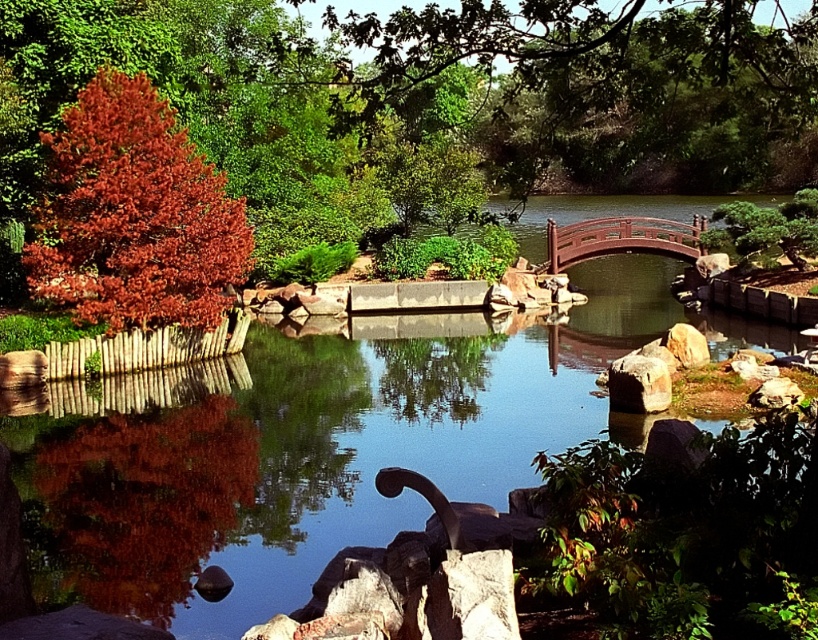
Question: Which point is closer to the camera taking this photo?

Choices:
 (A) (63, 244)
 (B) (609, 401)
 (C) (681, 225)

Answer: (B)

Question: From the image, what is the correct spatial relationship of shiny red tree at left in relation to wooden bridge at center?

Choices:
 (A) right
 (B) left

Answer: (B)

Question: Is shiny red tree at left thinner than wooden bridge at center?

Choices:
 (A) no
 (B) yes

Answer: (A)

Question: Which object is farther from the camera taking this photo?

Choices:
 (A) rusty metallic rock at lower right
 (B) shiny red tree at left

Answer: (B)

Question: Where is wooden bridge at center located in relation to rusty metallic rock at lower right in the image?

Choices:
 (A) left
 (B) right

Answer: (B)

Question: Which of these objects is positioned closest to the shiny red tree at left?

Choices:
 (A) rusty metallic rock at lower right
 (B) wooden bridge at center

Answer: (A)